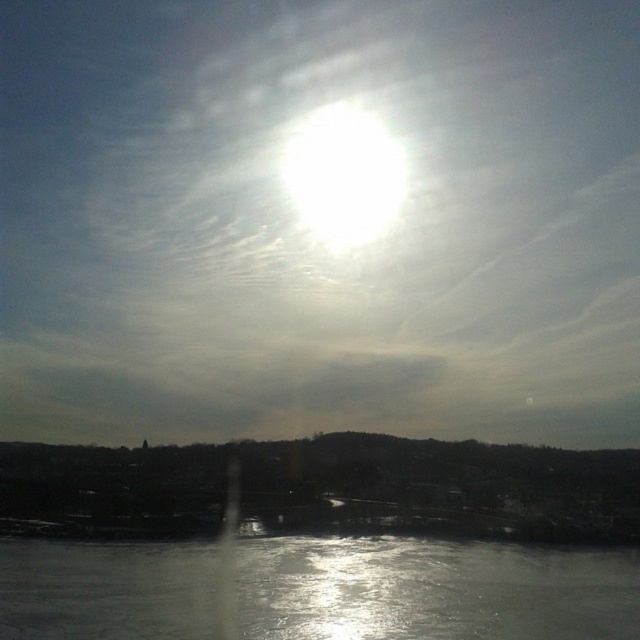
Who is positioned more to the right, bright white sun at upper center or glistening ice at bottom?

glistening ice at bottom is more to the right.

Who is shorter, bright white sun at upper center or glistening ice at bottom?

Standing shorter between the two is glistening ice at bottom.

Is point (83, 44) positioned in front of point (244, 564)?

No, it is behind (244, 564).

Image resolution: width=640 pixels, height=640 pixels. In order to click on bright white sun at upper center in this screenshot , I will do `click(305, 227)`.